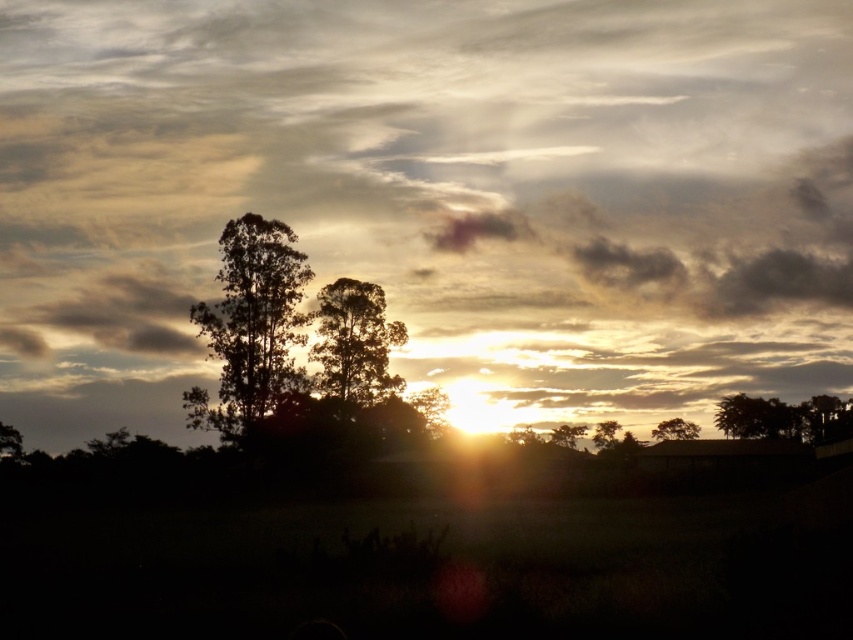
Which of these two, silhouette tree at right or silvery metallic tree at center, stands taller?

With more height is silhouette tree at right.

Is point (769, 419) closer to viewer compared to point (558, 432)?

Yes, it is in front of point (558, 432).

Where is `silhouette tree at right`? silhouette tree at right is located at coordinates (784, 417).

Is silhouette tree at right below silvery metallic tree at upper right?

No, silhouette tree at right is not below silvery metallic tree at upper right.

Can you confirm if silhouette tree at right is shorter than silvery metallic tree at upper right?

Indeed, silhouette tree at right has a lesser height compared to silvery metallic tree at upper right.

Locate an element on the screen. The width and height of the screenshot is (853, 640). silhouette tree at right is located at coordinates (784, 417).

Between point (811, 396) and point (616, 422), which one is positioned in front?

Point (616, 422)

Is silhouette tree at right bigger than silvery metallic tree at lower right?

Yes.

This screenshot has width=853, height=640. Find the location of `silhouette tree at right`. silhouette tree at right is located at coordinates (784, 417).